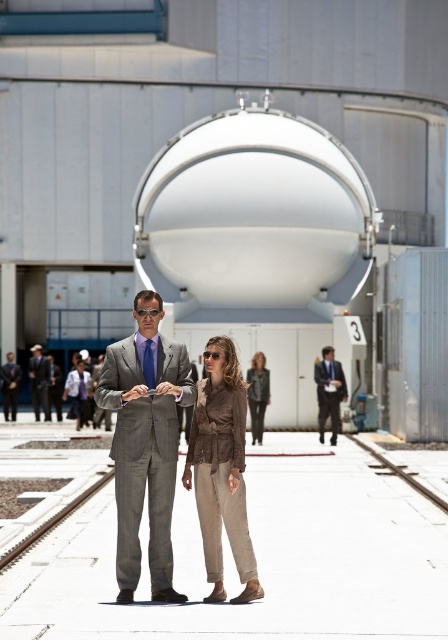
You are a security guard at this transportation facility. You need to ensure that the leather jacket at center and the matte gray suit at center are within a 30 feet safety zone. Based on the scene, are they within the required distance?

The distance between the leather jacket at center and the matte gray suit at center is 33.53 feet, which exceeds the 30 feet safety zone requirement. Therefore, they are not within the required distance.

You are an observer at the scene. You see the leather jacket at center and the matte gray suit at center. Which one takes up more space in the image?

The matte gray suit at center takes up more space than the leather jacket at center because the leather jacket at center occupies less space than matte gray suit at center.

You are a fashion designer observing a photo shoot at a transportation facility. You notice two models wearing a gray wool suit at center and a leather jacket at center. Which clothing item is covering part of the other?

The gray wool suit at center is positioned over the leather jacket at center, so it is covering part of the leather jacket at center.